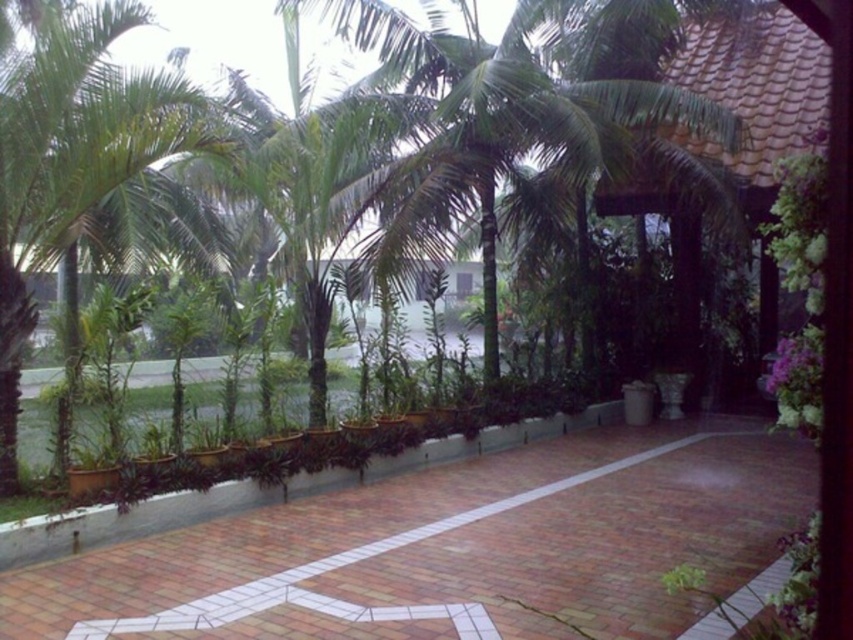
You are standing at the entrance of the walkway and want to reach the gazebo on the right. Which object should you pass first, the brick pavement at center or the green leafy palm tree at left?

You should pass the green leafy palm tree at left first since the brick pavement at center is located to its right.

You are standing on the brick pavement at center and want to walk towards the gazebo on the right. Which direction should you look to see the green leafy palm tree at left?

You should look to the left to see the green leafy palm tree at left, as the brick pavement at center is located below it, meaning the palm tree is positioned above the walkway in that direction.